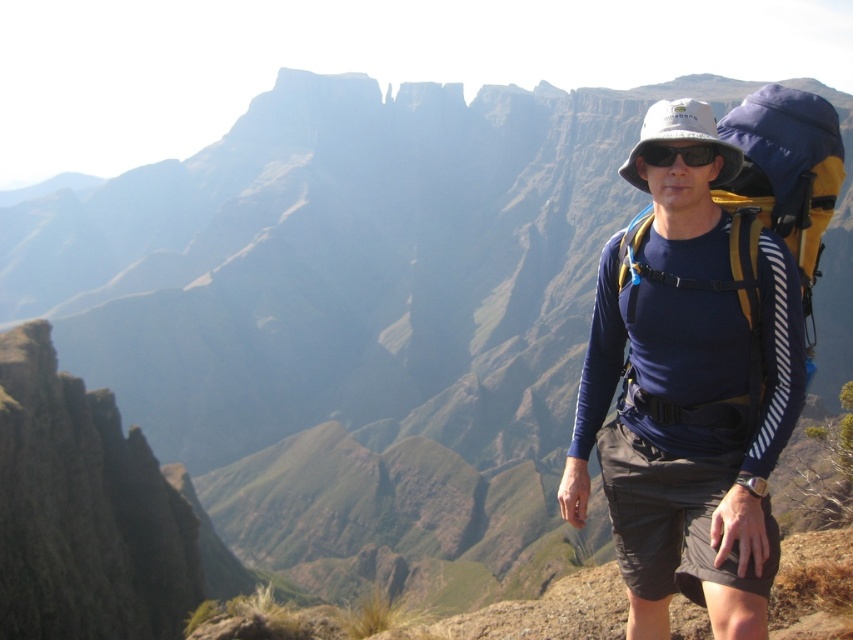
Who is more distant from viewer, (x=625, y=264) or (x=627, y=310)?

Positioned behind is point (x=625, y=264).

Is blue fabric shirt at center to the right of blue/yellow fabric backpack at right from the viewer's perspective?

Incorrect, blue fabric shirt at center is not on the right side of blue/yellow fabric backpack at right.

Locate an element on the screen. The image size is (853, 640). blue fabric shirt at center is located at coordinates (689, 392).

Who is positioned more to the left, blue/yellow fabric backpack at right or black matte sunglasses at center?

black matte sunglasses at center

Is point (753, 120) positioned behind point (701, 164)?

That is True.

Is point (785, 177) in front of point (640, 154)?

Yes, it is.

Locate an element on the screen. blue/yellow fabric backpack at right is located at coordinates (786, 176).

Is blue fabric shirt at center wider than black matte sunglasses at center?

Correct, the width of blue fabric shirt at center exceeds that of black matte sunglasses at center.

Is point (698, 509) less distant than point (689, 148)?

Yes.

Between point (740, 392) and point (637, 161), which one is positioned in front?

Point (740, 392)

This screenshot has height=640, width=853. Find the location of `blue fabric shirt at center`. blue fabric shirt at center is located at coordinates (689, 392).